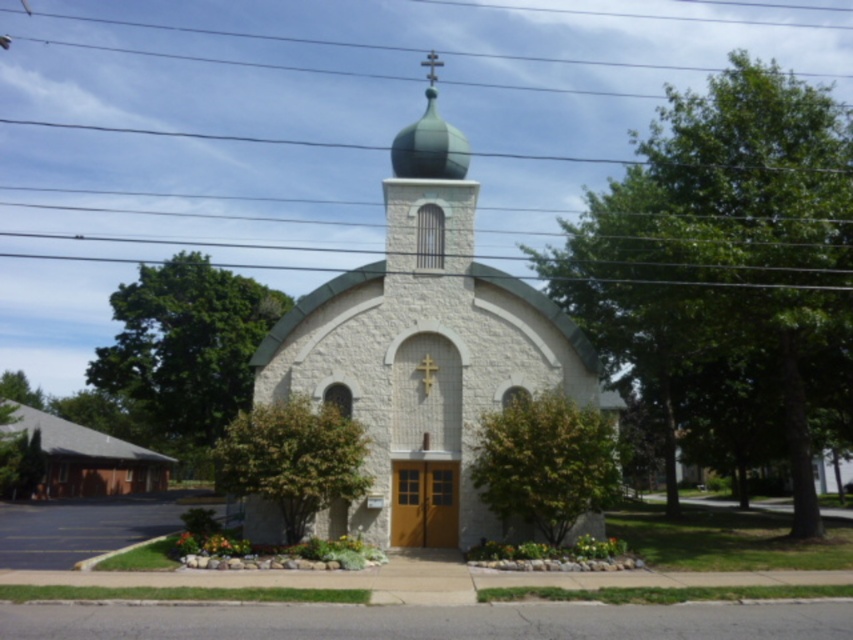
You are standing in front of the white stone church at center and want to enter through the yellow double doors. Can you see the green matte dome at center from your current position?

The white stone church at center is in front of the green matte dome at center, so yes, you can see the green matte dome at center from your current position because it is behind the church and visible from the front.

You are a photographer planning to capture the white stone church at center and the green matte dome at center in a single shot. Based on their heights, which one should you focus on to ensure both are fully visible in the frame?

The white stone church at center is much taller than the green matte dome at center, so focusing on the church will ensure both are fully visible in the frame.